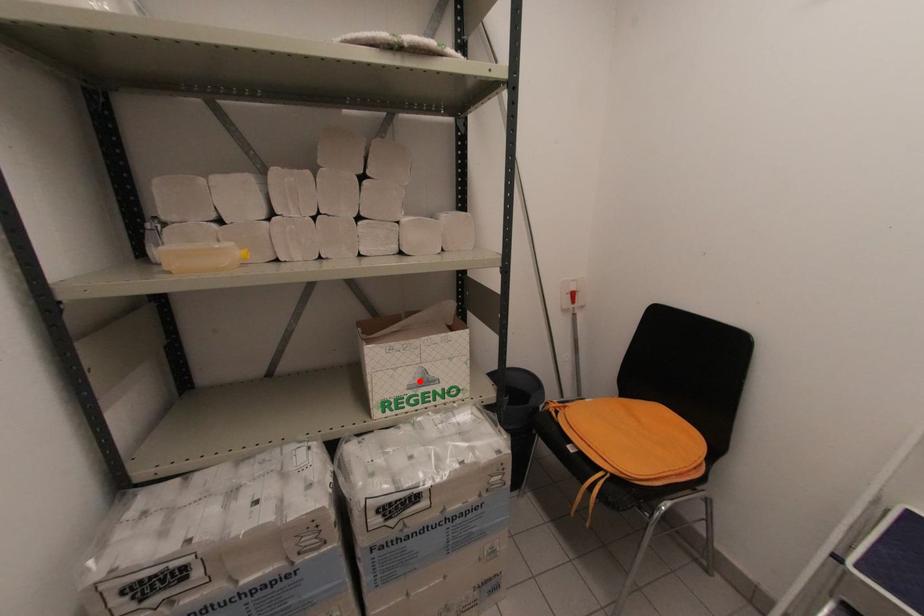
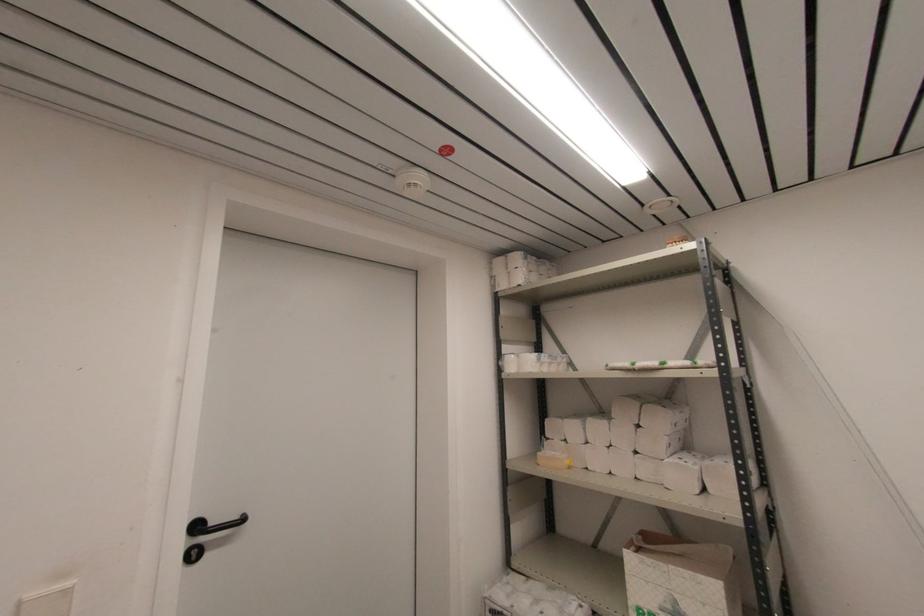
Question: I am providing you with two images of the same scene from different viewpoints. Image1 has a red point marked. In image2, the corresponding 3D location appears at what relative position? Reply with the corresponding letter.

Choices:
 (A) Closer
 (B) Farther

Answer: (A)